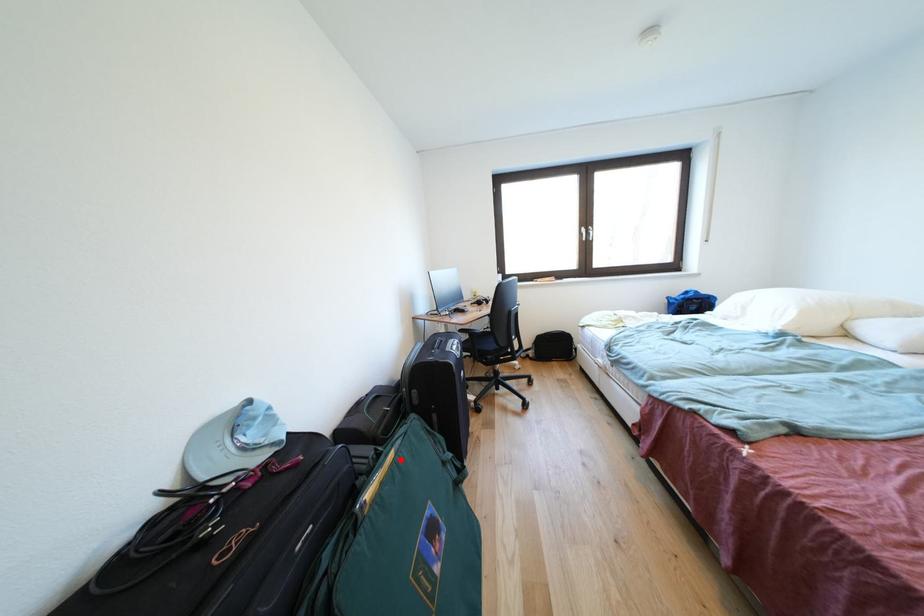
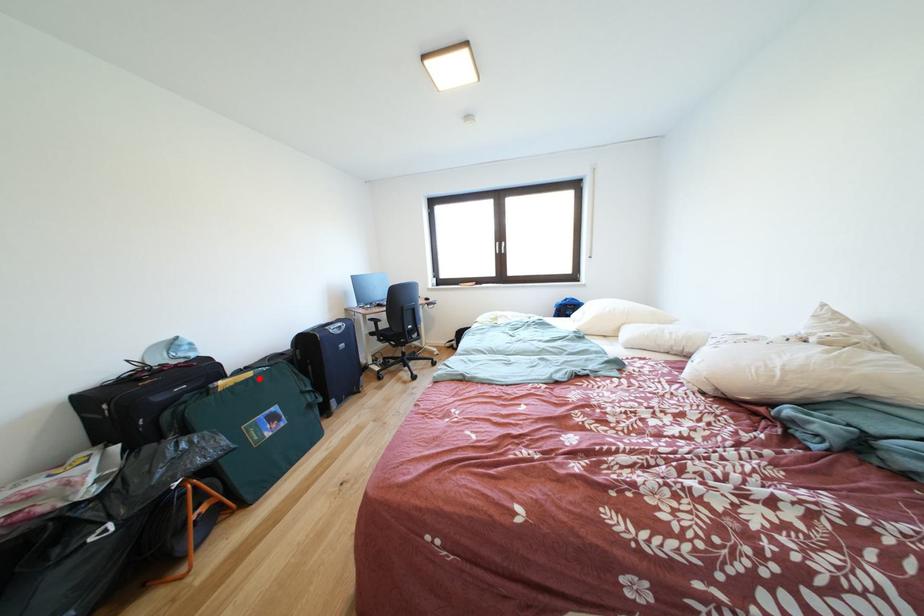
I am providing you with two images of the same scene from different viewpoints. A red point is marked on the first image and another point is marked on the second image. Do the highlighted points in image1 and image2 indicate the same real-world spot?

Yes